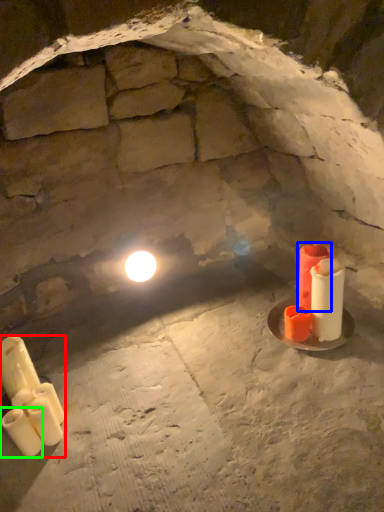
Question: Which object is the closest to the candle (highlighted by a red box)? Choose among these: candle (highlighted by a blue box) or candle (highlighted by a green box).

Choices:
 (A) candle
 (B) candle

Answer: (B)